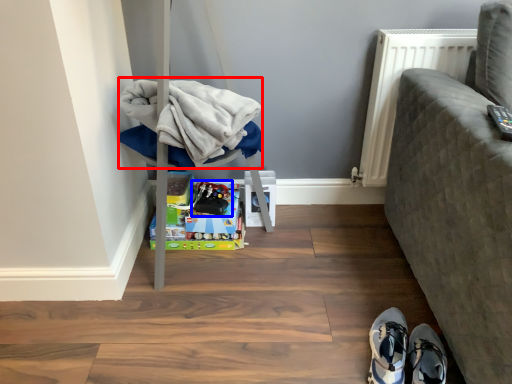
Question: Which object is closer to the camera taking this photo, clothing (highlighted by a red box) or toy (highlighted by a blue box)?

Choices:
 (A) clothing
 (B) toy

Answer: (A)